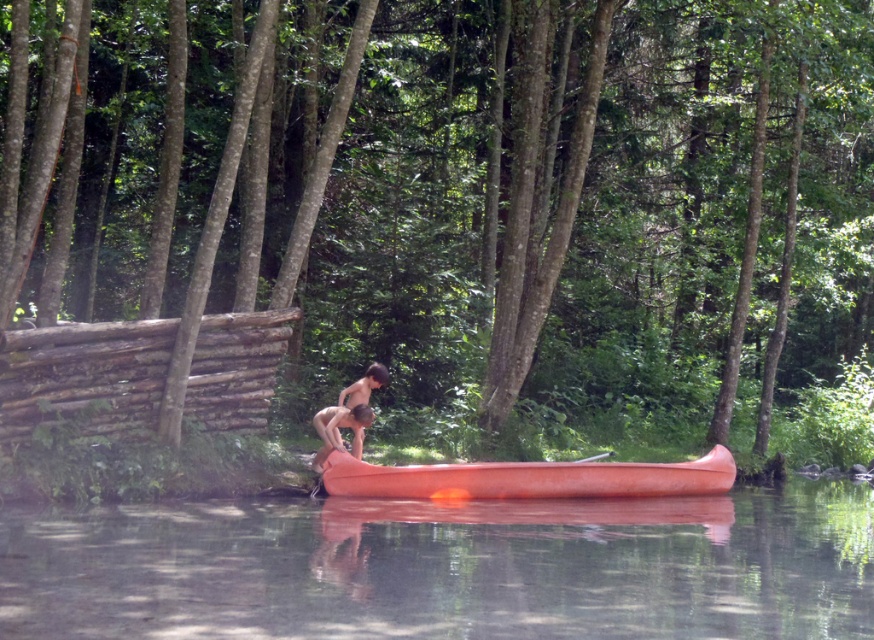
Is the position of transparent water at lower center more distant than that of smooth skin person at center?

No, it is in front of smooth skin person at center.

Is point (338, 596) more distant than point (350, 404)?

No, (338, 596) is in front of (350, 404).

Identify the location of transparent water at lower center. (447, 566).

Does smooth orange canoe at center have a greater height compared to smooth skin person at center?

Yes.

Who is shorter, smooth orange canoe at center or smooth skin person at center?

Standing shorter between the two is smooth skin person at center.

Find the location of a particular element. smooth orange canoe at center is located at coordinates click(x=336, y=428).

Can you confirm if transparent water at lower center is positioned to the left of orange smooth canoe at center?

Yes, transparent water at lower center is to the left of orange smooth canoe at center.

Which is behind, point (539, 545) or point (442, 474)?

The point (442, 474) is more distant.

Where is `transparent water at lower center`? The image size is (874, 640). transparent water at lower center is located at coordinates point(447,566).